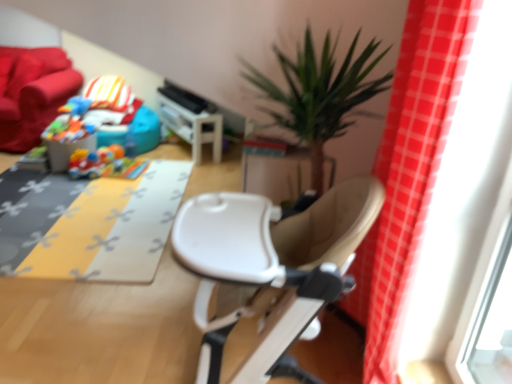
Question: Are yellow fabric mat at center and plastic colorful car at center, marked as the first toy in a bottom-to-top arrangement, beside each other?

Choices:
 (A) no
 (B) yes

Answer: (A)

Question: From the image's perspective, is yellow fabric mat at center over plastic colorful car at center, marked as the second toy in a top-to-bottom arrangement?

Choices:
 (A) yes
 (B) no

Answer: (B)

Question: Does yellow fabric mat at center come in front of plastic colorful car at center, arranged as the 2th toy when viewed from the left?

Choices:
 (A) no
 (B) yes

Answer: (B)

Question: Could you tell me if yellow fabric mat at center is turned towards plastic colorful car at center, arranged as the 2th toy when viewed from the left?

Choices:
 (A) yes
 (B) no

Answer: (B)

Question: Can you confirm if yellow fabric mat at center is smaller than plastic colorful car at center, arranged as the 2th toy when viewed from the left?

Choices:
 (A) no
 (B) yes

Answer: (A)

Question: Is red plaid curtain at right in front of or behind plastic colorful car at center, marked as the second toy in a top-to-bottom arrangement, in the image?

Choices:
 (A) front
 (B) behind

Answer: (A)

Question: From the image's perspective, is red plaid curtain at right above or below plastic colorful car at center, which is the first toy from right to left?

Choices:
 (A) above
 (B) below

Answer: (B)

Question: Considering the positions of red plaid curtain at right and plastic colorful car at center, which is the first toy from right to left, in the image, is red plaid curtain at right bigger or smaller than plastic colorful car at center, which is the first toy from right to left,?

Choices:
 (A) small
 (B) big

Answer: (B)

Question: From a real-world perspective, is red plaid curtain at right physically located above or below plastic colorful car at center, marked as the second toy in a top-to-bottom arrangement?

Choices:
 (A) above
 (B) below

Answer: (A)

Question: Is plastic colorful car at center, marked as the first toy in a bottom-to-top arrangement, situated inside red plaid curtain at right or outside?

Choices:
 (A) outside
 (B) inside

Answer: (A)

Question: Considering the positions of plastic colorful car at center, marked as the first toy in a bottom-to-top arrangement, and red plaid curtain at right in the image, is plastic colorful car at center, marked as the first toy in a bottom-to-top arrangement, taller or shorter than red plaid curtain at right?

Choices:
 (A) tall
 (B) short

Answer: (B)

Question: Looking at their shapes, would you say plastic colorful car at center, marked as the first toy in a bottom-to-top arrangement, is wider or thinner than red plaid curtain at right?

Choices:
 (A) wide
 (B) thin

Answer: (A)

Question: From the image's perspective, relative to red plaid curtain at right, is plastic colorful car at center, arranged as the 2th toy when viewed from the left, above or below?

Choices:
 (A) above
 (B) below

Answer: (A)

Question: From a real-world perspective, is plastic colorful car at center, arranged as the 2th toy when viewed from the left, physically located above or below white plastic table at center?

Choices:
 (A) below
 (B) above

Answer: (A)

Question: Visually, is plastic colorful car at center, arranged as the 2th toy when viewed from the left, positioned to the left or to the right of white plastic table at center?

Choices:
 (A) left
 (B) right

Answer: (A)